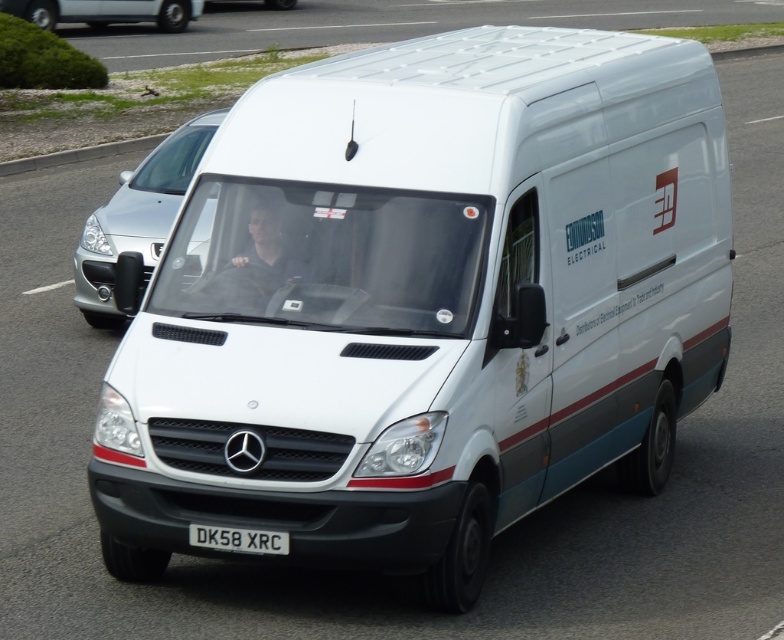
You are standing on the sidewalk and see the satin silver car at left and the white plastic license plate at center in the image. Which object is positioned more to the left side of the image?

The satin silver car at left is positioned more to the left side of the image than the white plastic license plate at center.

Based on the photo, based on the scene description, where exactly is the satin silver car at left located in the image?

The satin silver car at left is located at point coordinates of 0.342 in the x axis and 0.176 in the y axis.

You are a traffic officer observing the road. You notice a satin silver car at left and a silver metallic van at upper left. Which vehicle has a higher height?

The satin silver car at left has a greater height compared to the silver metallic van at upper left.